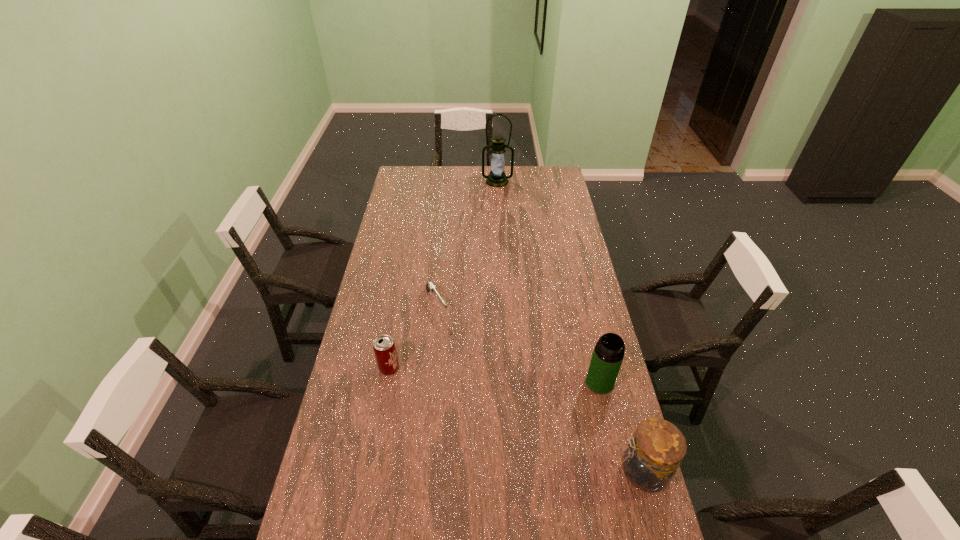
At what (x,y) coordinates should I click in order to perform the action: click on the second shortest object. Please return your answer as a coordinate pair (x, y). Looking at the image, I should click on (384, 348).

Find the location of a particular element. beer can is located at coordinates (384, 348).

This screenshot has height=540, width=960. I want to click on the third shortest object, so click(650, 460).

The width and height of the screenshot is (960, 540). Identify the location of jar. (650, 460).

This screenshot has width=960, height=540. In order to click on thermos bottle in this screenshot , I will do `click(608, 354)`.

Identify the location of the second object from left to right. This screenshot has width=960, height=540. (430, 287).

Image resolution: width=960 pixels, height=540 pixels. I want to click on pistol, so click(x=430, y=287).

I want to click on the third object from right to left, so click(x=497, y=178).

Where is `the tallest object`? The image size is (960, 540). the tallest object is located at coordinates (497, 178).

I want to click on vacant space located on the front of the fourth tallest object, so click(380, 417).